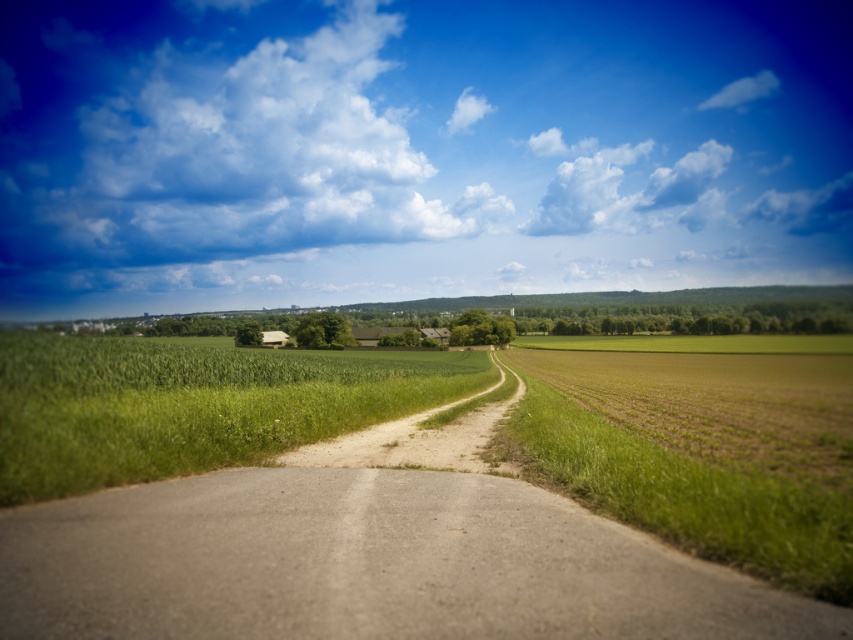
Is brown dirt track at center smaller than green grassy field at center?

Correct, brown dirt track at center occupies less space than green grassy field at center.

Does brown dirt track at center appear on the left side of green grassy field at center?

In fact, brown dirt track at center is to the right of green grassy field at center.

Does point (814, 630) lie behind point (178, 346)?

That is False.

Where is `brown dirt track at center`? brown dirt track at center is located at coordinates (367, 560).